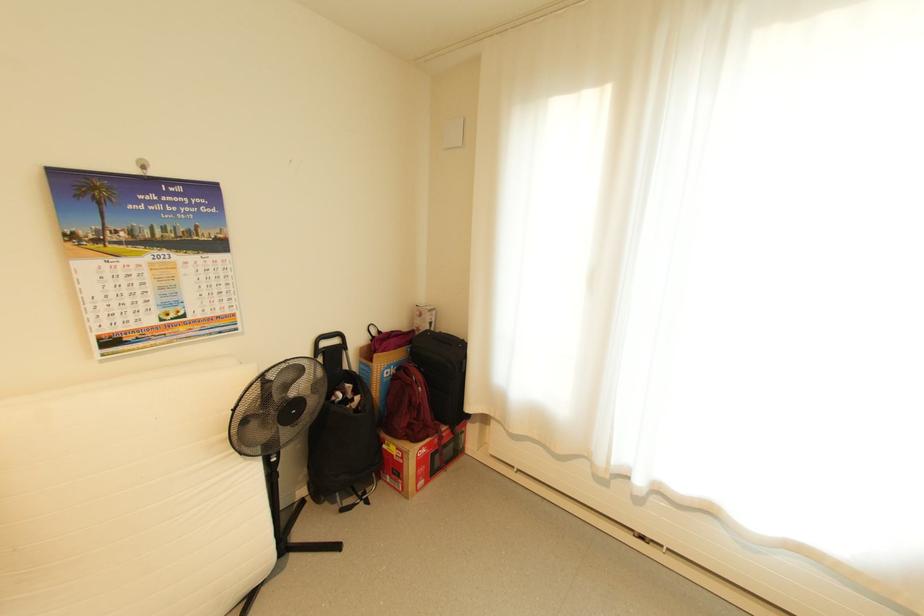
Identify the location of wall suction hook. The width and height of the screenshot is (924, 616). (141, 164).